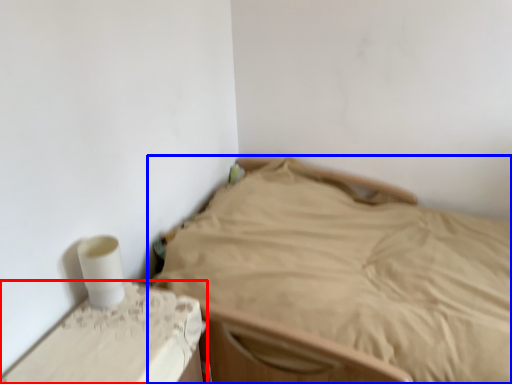
Question: Which of the following is the farthest to the observer, furniture (highlighted by a red box) or bed (highlighted by a blue box)?

Choices:
 (A) furniture
 (B) bed

Answer: (A)